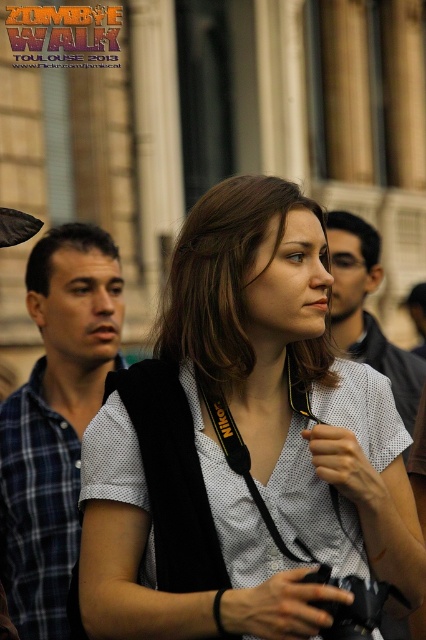
Question: Which point appears farthest from the camera in this image?

Choices:
 (A) (400, 369)
 (B) (336, 532)
 (C) (46, 308)

Answer: (A)

Question: Is blue plaid shirt at left further to the viewer compared to metallic text at upper left?

Choices:
 (A) yes
 (B) no

Answer: (B)

Question: Which of the following is the closest to the observer?

Choices:
 (A) (327, 353)
 (B) (43, 10)

Answer: (A)

Question: Does blue plaid shirt at left have a smaller size compared to matte white shirt at center?

Choices:
 (A) no
 (B) yes

Answer: (A)

Question: Does matte black shirt at center have a larger size compared to metallic text at upper left?

Choices:
 (A) yes
 (B) no

Answer: (A)

Question: Considering the real-world distances, which object is closest to the matte black shirt at center?

Choices:
 (A) matte white shirt at center
 (B) blue plaid shirt at left

Answer: (B)